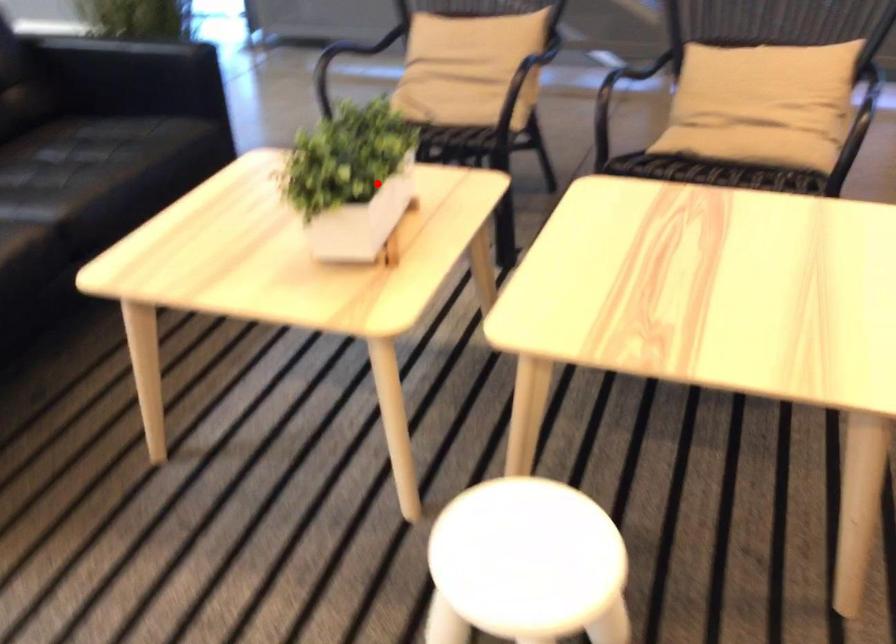
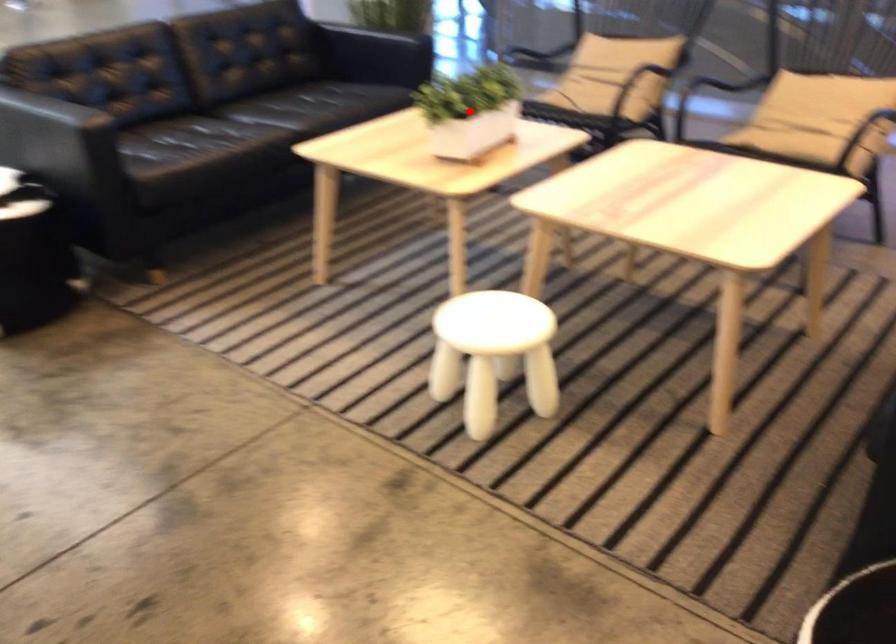
I am providing you with two images of the same scene from different viewpoints. A red point is marked on the first image and another point is marked on the second image. Is the red point in image1 aligned with the point shown in image2?

Yes